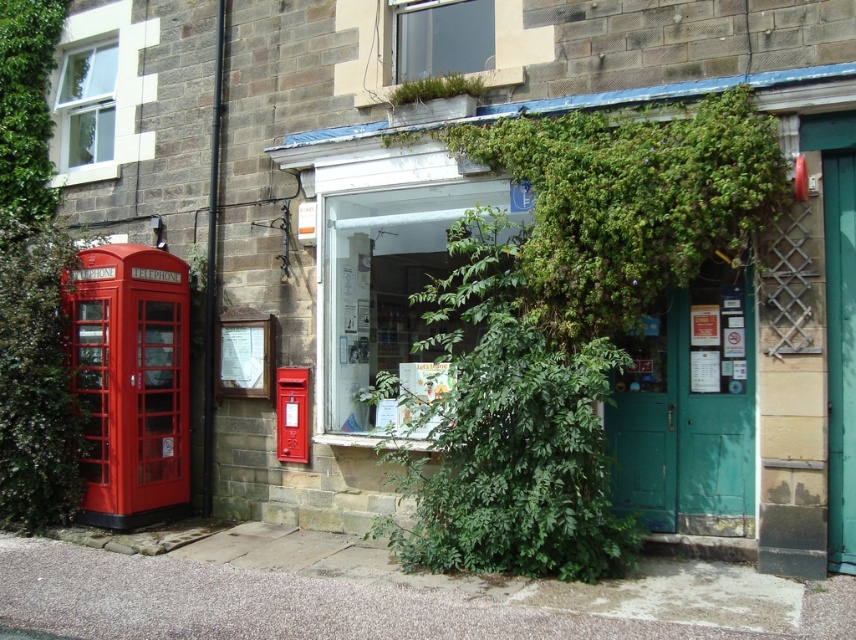
You are a delivery person trying to deliver a package to the green wooden door at center. The metallic red postbox at center is blocking your path. Can you still reach the door without moving the postbox?

The green wooden door at center is larger in size than metallic red postbox at center, so the door is bigger and likely has enough space around it for you to navigate around the postbox and reach it without moving the obstruction.

You are a delivery person trying to reach the green wooden door at center to drop off a package. There is a metallic red postbox at center in your way. Since both are at the center, can you walk between them?

The green wooden door at center is taller than metallic red postbox at center, but since both are positioned at the center, there might not be enough space to walk between them. You should check the distance between them before attempting to pass.